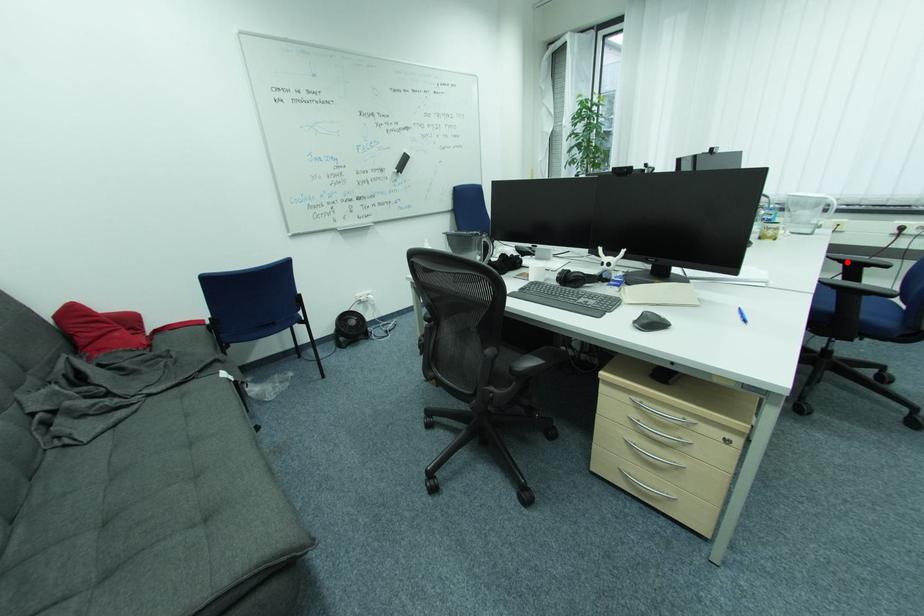
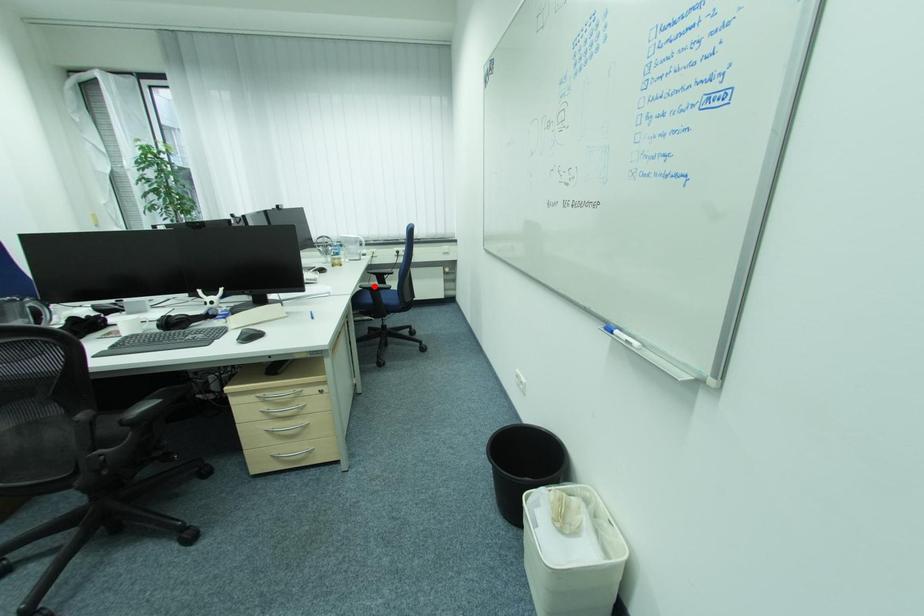
Consider the image. I am providing you with two images of the same scene from different viewpoints. A red point is marked on the first image and another point is marked on the second image. Are the points marked in image1 and image2 representing the same 3D position?

No